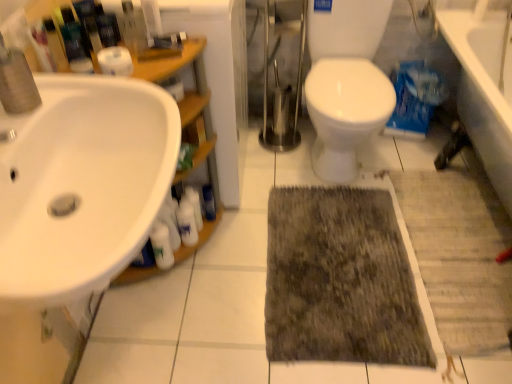
I want to click on vacant space in front of white glossy bottle at lower left, which appears as the second cleaning product when viewed from the left, so (x=189, y=285).